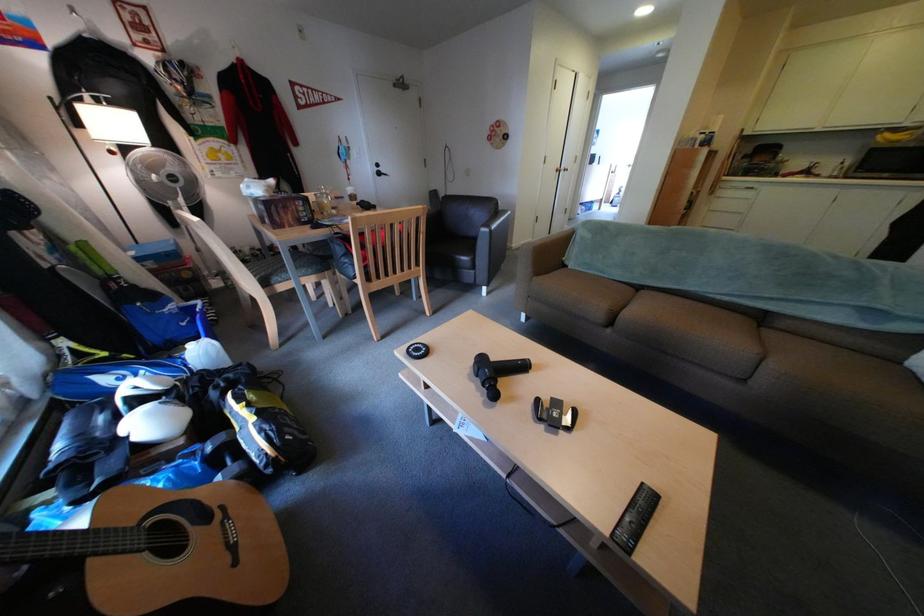
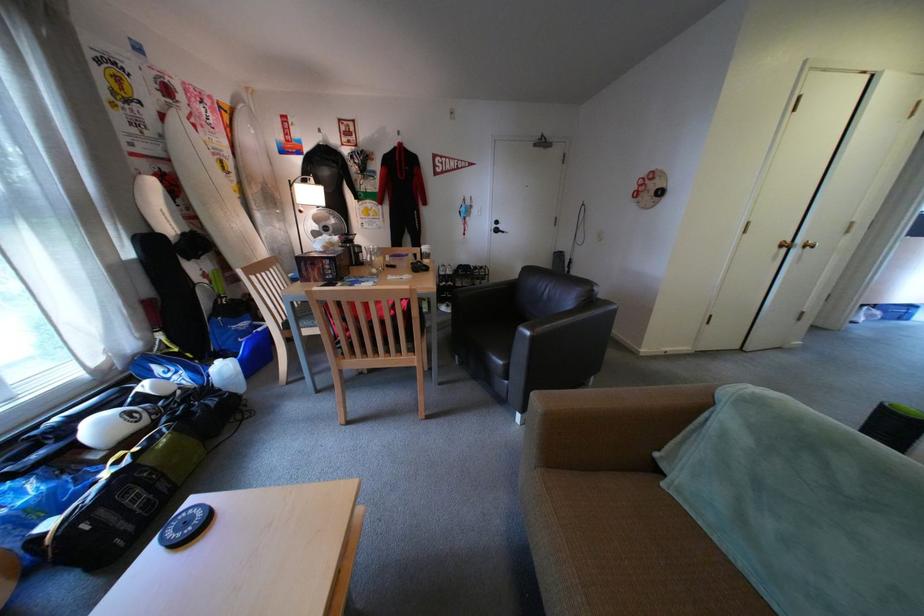
The point at (496, 296) is marked in the first image. Where is the corresponding point in the second image?

(530, 422)